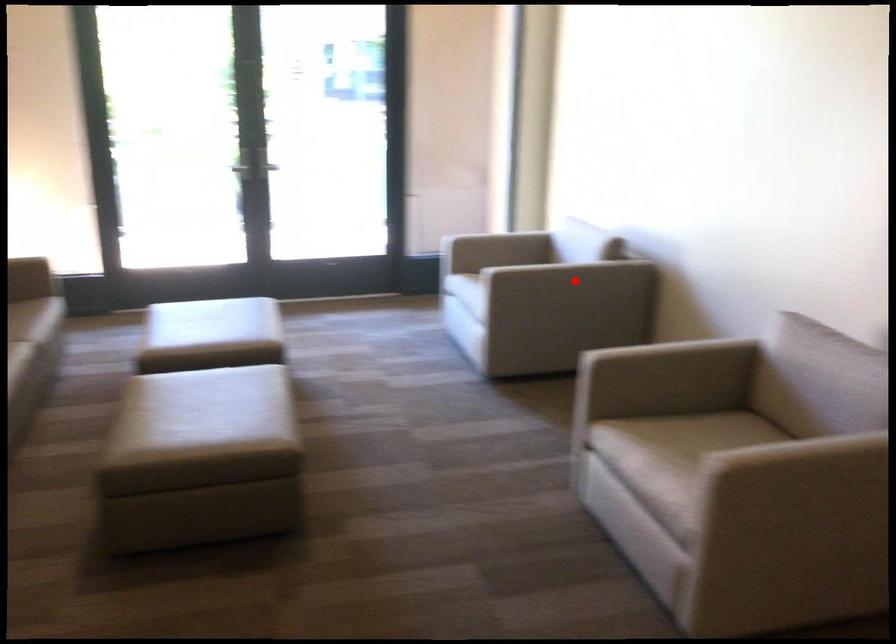
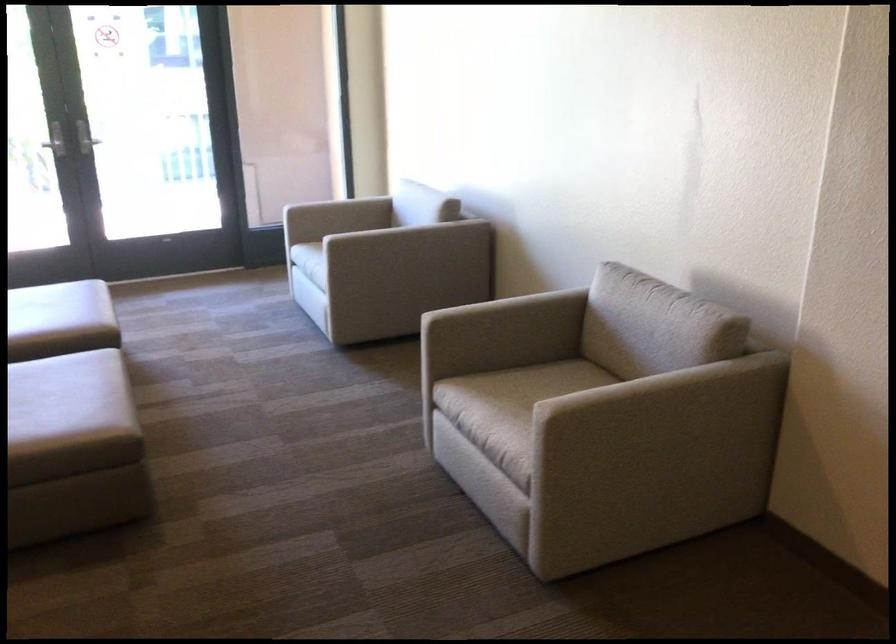
Locate, in the second image, the point that corresponds to the highlighted location in the first image.

(417, 242)